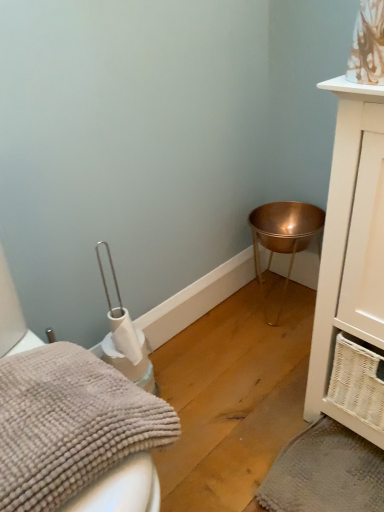
Question: Can you confirm if white wicker cabinet at right is smaller than gray textured bath towel at lower right, which is the second bath towel in top-to-bottom order?

Choices:
 (A) no
 (B) yes

Answer: (A)

Question: Can you confirm if white wicker cabinet at right is wider than gray textured bath towel at lower right, placed as the first bath towel when sorted from back to front?

Choices:
 (A) yes
 (B) no

Answer: (A)

Question: Is white wicker cabinet at right directly adjacent to gray textured bath towel at lower right, acting as the second bath towel starting from the front?

Choices:
 (A) yes
 (B) no

Answer: (B)

Question: Does white wicker cabinet at right come in front of gray textured bath towel at lower right, marked as the 1th bath towel in a right-to-left arrangement?

Choices:
 (A) no
 (B) yes

Answer: (B)

Question: From the image's perspective, is white wicker cabinet at right located beneath gray textured bath towel at lower right, which is the 1th bath towel in bottom-to-top order?

Choices:
 (A) yes
 (B) no

Answer: (B)

Question: Choose the correct answer: Is copper metallic bowl at lower right inside white wicker cabinet at right or outside it?

Choices:
 (A) outside
 (B) inside

Answer: (A)

Question: From the image's perspective, is copper metallic bowl at lower right located above or below white wicker cabinet at right?

Choices:
 (A) below
 (B) above

Answer: (A)

Question: Is copper metallic bowl at lower right taller or shorter than white wicker cabinet at right?

Choices:
 (A) short
 (B) tall

Answer: (A)

Question: Visually, is copper metallic bowl at lower right positioned to the left or to the right of white wicker cabinet at right?

Choices:
 (A) left
 (B) right

Answer: (A)

Question: Is gray fluffy bath towel at lower left, the 2th bath towel from the right, bigger or smaller than white wicker cabinet at right?

Choices:
 (A) big
 (B) small

Answer: (B)

Question: Considering the relative positions of gray fluffy bath towel at lower left, the 1th bath towel from the left, and white wicker cabinet at right in the image provided, is gray fluffy bath towel at lower left, the 1th bath towel from the left, to the left or to the right of white wicker cabinet at right?

Choices:
 (A) right
 (B) left

Answer: (B)

Question: Relative to white wicker cabinet at right, is gray fluffy bath towel at lower left, positioned as the first bath towel in front-to-back order, in front or behind?

Choices:
 (A) behind
 (B) front

Answer: (B)

Question: Do you think gray fluffy bath towel at lower left, the 1th bath towel from the left, is within white wicker cabinet at right, or outside of it?

Choices:
 (A) inside
 (B) outside

Answer: (B)

Question: From their relative heights in the image, would you say white wicker cabinet at right is taller or shorter than copper metallic bowl at lower right?

Choices:
 (A) tall
 (B) short

Answer: (A)

Question: Is white wicker cabinet at right to the left or to the right of copper metallic bowl at lower right in the image?

Choices:
 (A) right
 (B) left

Answer: (A)